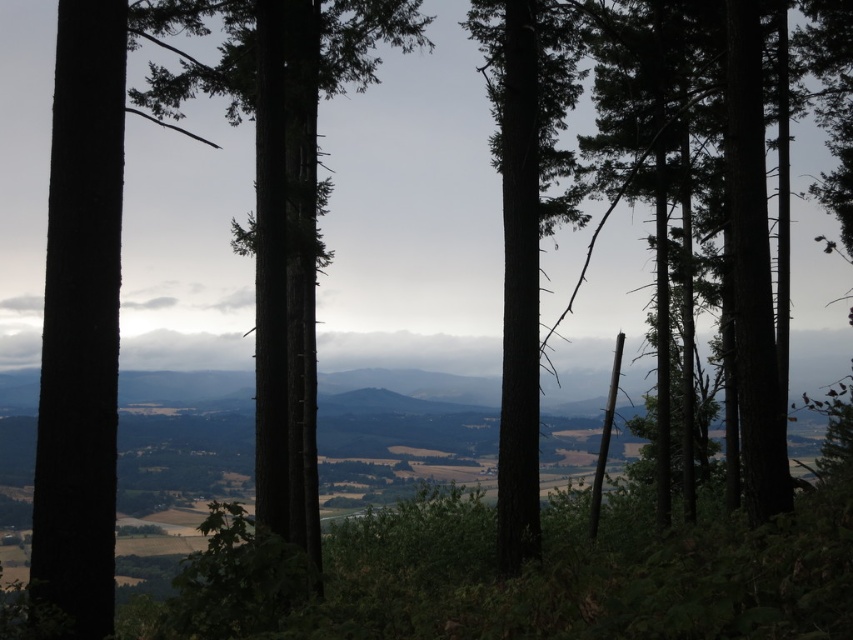
Between point (231, 86) and point (581, 193), which one is positioned behind?

The point (581, 193) is behind.

Is point (245, 88) positioned behind point (532, 534)?

Yes, it is behind point (532, 534).

Locate an element on the screen. dark green bark tree at center is located at coordinates (280, 198).